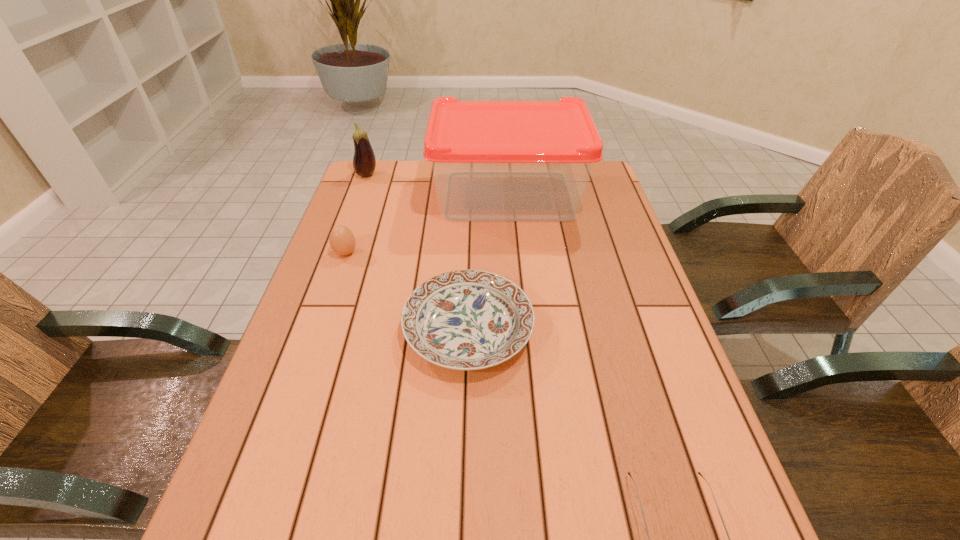
You are a GUI agent. You are given a task and a screenshot of the screen. Output one action in this format:
    pyautogui.click(x=<x>, y=<y>)
    Task: Click on the tallest object
    
    Given the screenshot: What is the action you would take?
    pyautogui.click(x=492, y=160)

Identify the location of the fourth shortest object. (364, 162).

The width and height of the screenshot is (960, 540). I want to click on boiled egg, so click(x=342, y=241).

Image resolution: width=960 pixels, height=540 pixels. What are the coordinates of `the third nearest object` in the screenshot? It's located at (342, 241).

This screenshot has width=960, height=540. What are the coordinates of `plate` in the screenshot? It's located at (467, 320).

The image size is (960, 540). Find the location of `blank area located 0.250m on the front of the tallest object`. blank area located 0.250m on the front of the tallest object is located at coordinates (516, 289).

You are a GUI agent. You are given a task and a screenshot of the screen. Output one action in this format:
    pyautogui.click(x=<x>, y=<y>)
    Task: Click on the vacant space located on the front of the fourth shortest object
    
    Given the screenshot: What is the action you would take?
    pyautogui.click(x=352, y=214)

The width and height of the screenshot is (960, 540). Find the location of `free space located 0.100m on the back of the third farthest object`. free space located 0.100m on the back of the third farthest object is located at coordinates (355, 224).

Locate an element on the screen. This screenshot has width=960, height=540. vacant space situated on the back of the plate is located at coordinates (470, 232).

The height and width of the screenshot is (540, 960). Identify the location of tray positioned at the far edge. (492, 160).